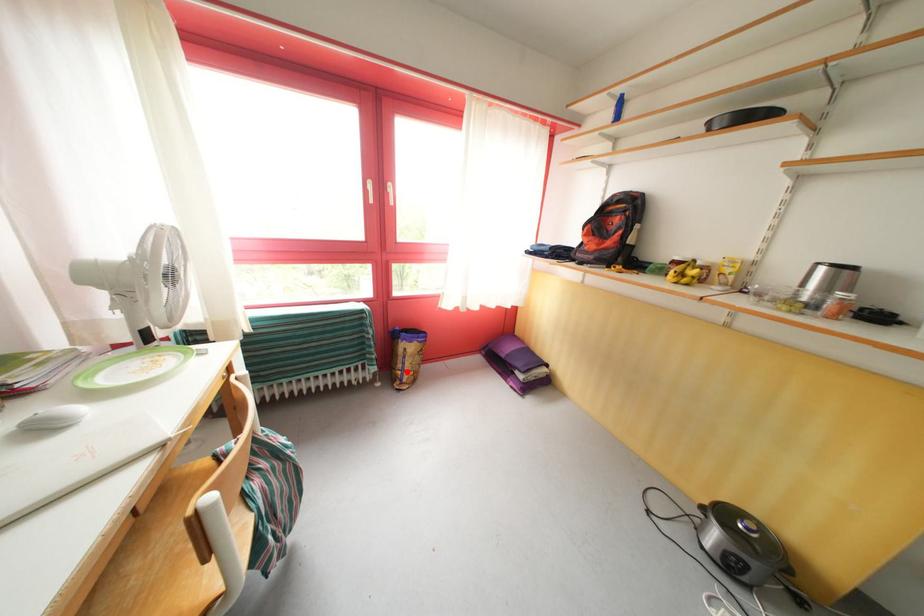
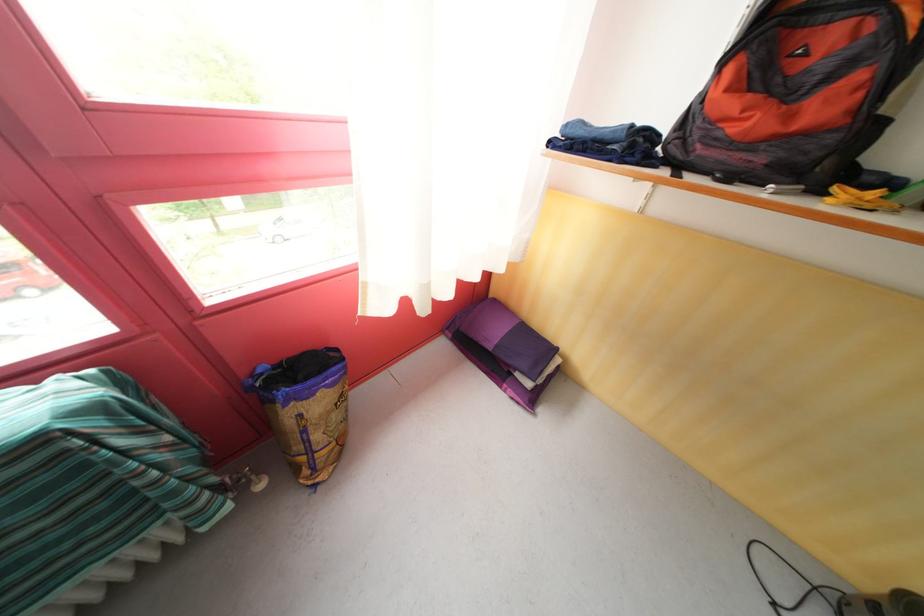
Question: I am providing you with two images of the same scene from different viewpoints. Given a red point in image1, look at the same physical point in image2. Is it:

Choices:
 (A) Closer to the viewpoint
 (B) Farther from the viewpoint

Answer: (A)